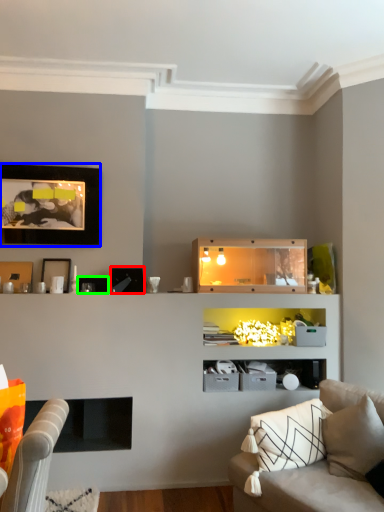
Question: Which object is positioned closest to picture frame (highlighted by a red box)? Select from picture frame (highlighted by a blue box) and picture frame (highlighted by a green box).

Choices:
 (A) picture frame
 (B) picture frame

Answer: (B)